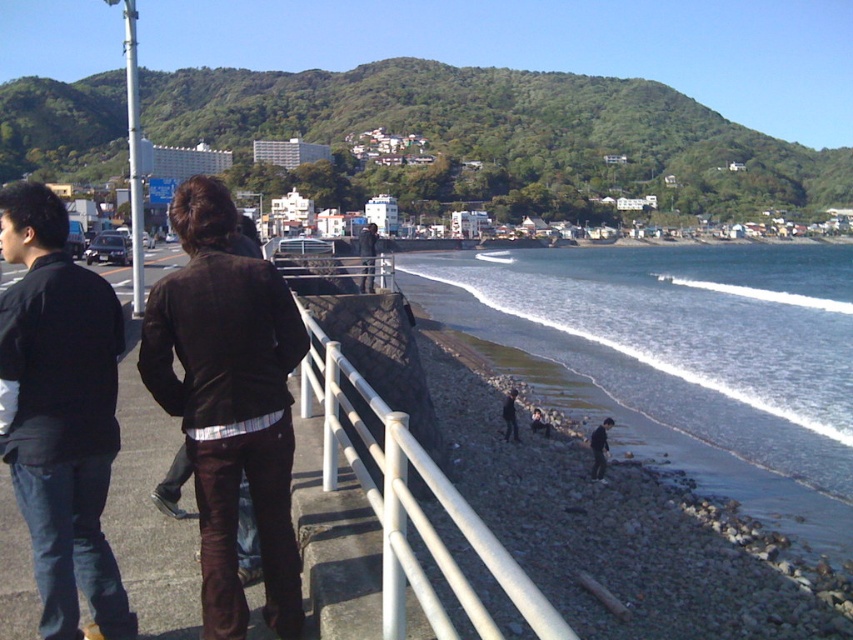
You are standing on the paved walkway with a white metal railing and see the clear water at beach right and the dark brown leather jacket at left. Which object is taller when viewed from your position?

The clear water at beach right is taller than the dark brown leather jacket at left.

You are standing at the white plastic rail at lower center and want to walk towards the clear water at beach right. Which direction should you move?

You should move to your right since the clear water at beach right is located to the right of the white plastic rail at lower center.